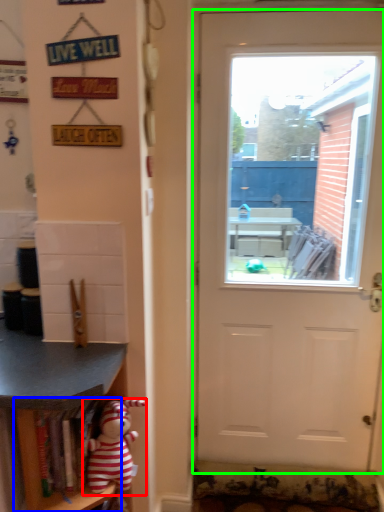
Question: Which object is positioned closest to toy (highlighted by a red box)? Select from shelf (highlighted by a blue box) and door (highlighted by a green box).

Choices:
 (A) shelf
 (B) door

Answer: (A)